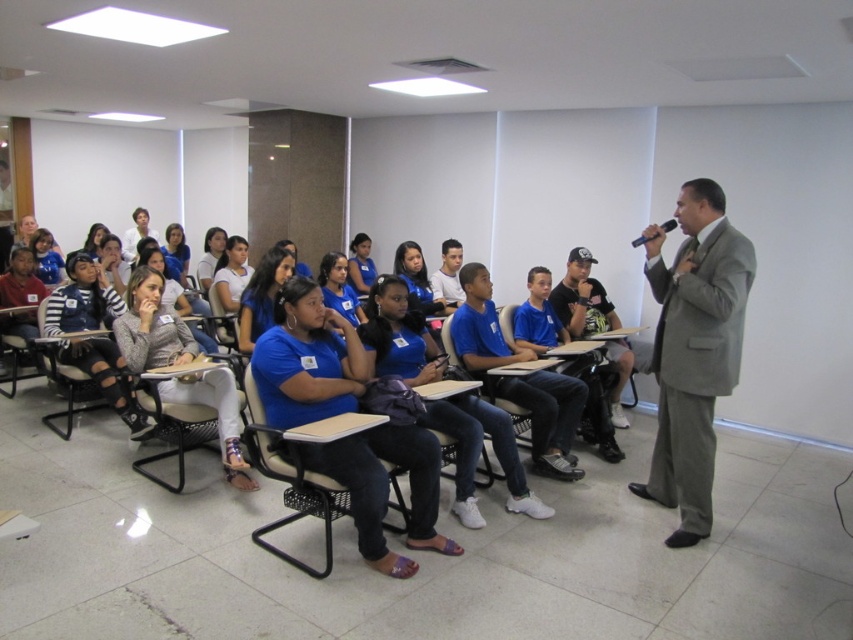
Looking at this image, can you confirm if blue cotton shirt at center is positioned to the right of denim fabric chair at lower left?

Indeed, blue cotton shirt at center is positioned on the right side of denim fabric chair at lower left.

Who is taller, blue cotton shirt at center or denim fabric chair at lower left?

Standing taller between the two is blue cotton shirt at center.

This screenshot has height=640, width=853. Describe the element at coordinates (582, 298) in the screenshot. I see `blue cotton shirt at center` at that location.

Locate an element on the screen. blue cotton shirt at center is located at coordinates (582, 298).

Is point (686, 445) closer to viewer compared to point (306, 572)?

No, it is not.

Does gray suit at right have a lesser height compared to black plastic chair at center?

No, gray suit at right is not shorter than black plastic chair at center.

Measure the distance between gray suit at right and camera.

The distance of gray suit at right from camera is 9.90 feet.

The width and height of the screenshot is (853, 640). I want to click on gray suit at right, so click(693, 349).

Looking at this image, who is shorter, black plastic chair at center or matte black chair at left?

With less height is matte black chair at left.

Who is more forward, (x=393, y=468) or (x=33, y=333)?

Point (x=393, y=468)

What do you see at coordinates (289, 481) in the screenshot?
I see `black plastic chair at center` at bounding box center [289, 481].

Find the location of a particular element. This screenshot has width=853, height=640. black plastic chair at center is located at coordinates (289, 481).